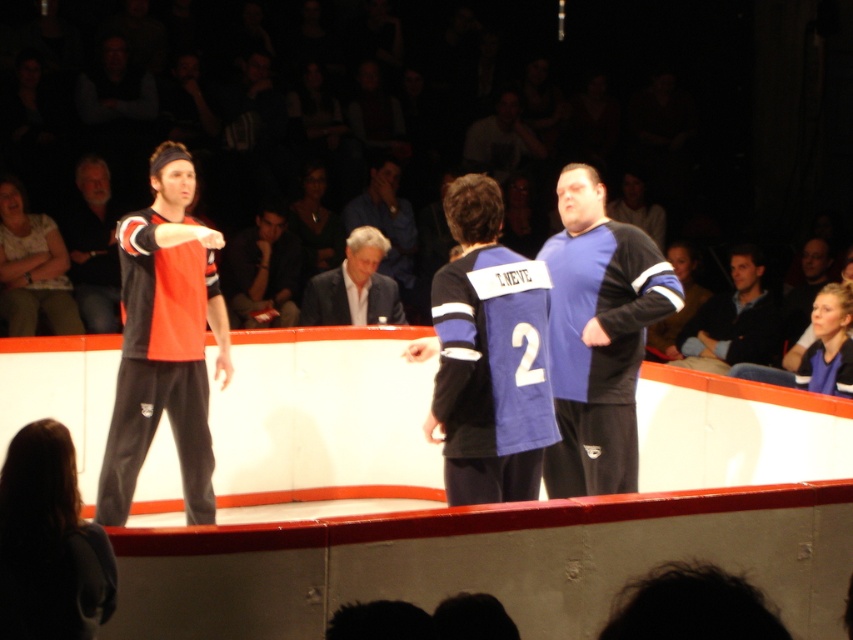
You are a photographer standing in the middle of the scene. You need to take a photo of both the dark hair at lower left and the dark blue sweater at right. Which object should you adjust your camera to focus on first if you want to capture both in the frame?

Since the dark hair at lower left is to the left of dark blue sweater at right, you should focus on the dark hair at lower left first as it is positioned further to the left and closer to your current position, ensuring both are included in the frame.

You are a photographer at the event and need to capture a closeup shot of both the dark hair at lower left and the white textured shirt at left. Based on their sizes, which one should you focus on first to ensure it doesn t get too small in the frame?

The dark hair at lower left has a smaller size compared to the white textured shirt at left, so you should focus on the dark hair at lower left first to ensure it doesn t become too small in the frame.